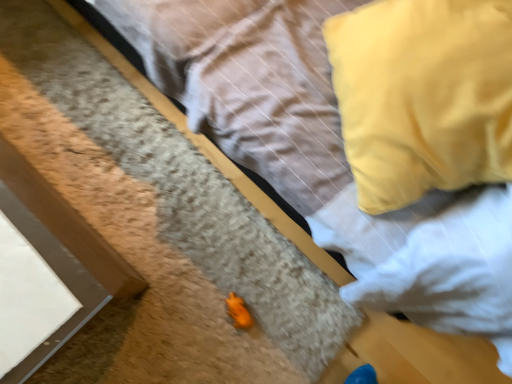
Find the location of a particular element. This screenshot has width=512, height=384. free space in front of orange matte toy frog at lower center is located at coordinates (207, 350).